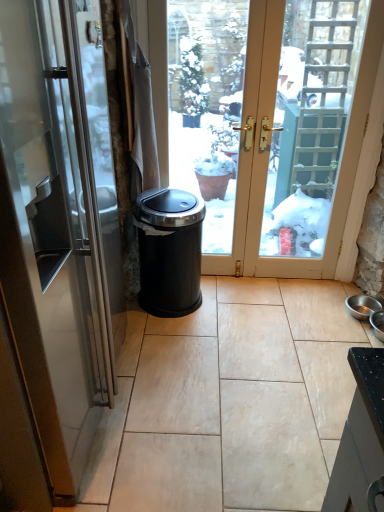
Question: From a real-world perspective, is satin silver door at left located beneath black plastic trash can at center?

Choices:
 (A) no
 (B) yes

Answer: (A)

Question: From the image's perspective, is satin silver door at left under black plastic trash can at center?

Choices:
 (A) no
 (B) yes

Answer: (A)

Question: Is satin silver door at left to the right of black plastic trash can at center from the viewer's perspective?

Choices:
 (A) yes
 (B) no

Answer: (B)

Question: Can you confirm if satin silver door at left is bigger than black plastic trash can at center?

Choices:
 (A) no
 (B) yes

Answer: (B)

Question: Does satin silver door at left turn towards black plastic trash can at center?

Choices:
 (A) no
 (B) yes

Answer: (B)

Question: From the image's perspective, is satin silver door at left on black plastic trash can at center?

Choices:
 (A) no
 (B) yes

Answer: (B)

Question: From the image's perspective, is black plastic trash can at center on top of satin silver door at left?

Choices:
 (A) no
 (B) yes

Answer: (A)

Question: Is black plastic trash can at center turned away from satin silver door at left?

Choices:
 (A) no
 (B) yes

Answer: (A)

Question: Could satin silver door at left be considered to be inside black plastic trash can at center?

Choices:
 (A) yes
 (B) no

Answer: (B)

Question: Does black plastic trash can at center have a greater height compared to satin silver door at left?

Choices:
 (A) yes
 (B) no

Answer: (B)

Question: Is black plastic trash can at center wider than satin silver door at left?

Choices:
 (A) no
 (B) yes

Answer: (A)

Question: Is black plastic trash can at center positioned beyond the bounds of satin silver door at left?

Choices:
 (A) no
 (B) yes

Answer: (B)

Question: Considering the positions of satin silver door at left and black plastic trash can at center in the image, is satin silver door at left bigger or smaller than black plastic trash can at center?

Choices:
 (A) big
 (B) small

Answer: (A)